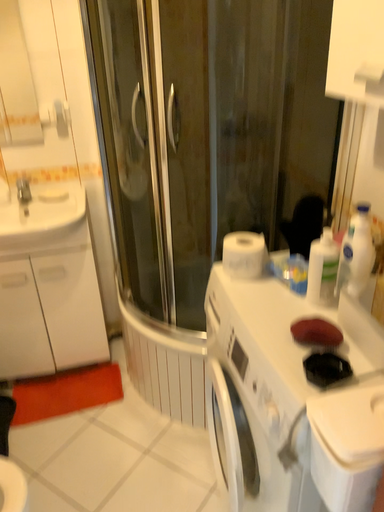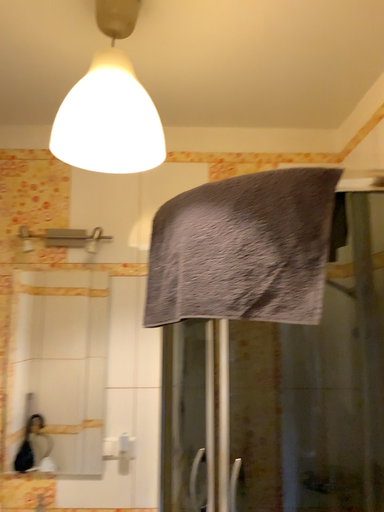
Question: Which way did the camera rotate in the video?

Choices:
 (A) rotated downward
 (B) rotated upward

Answer: (B)